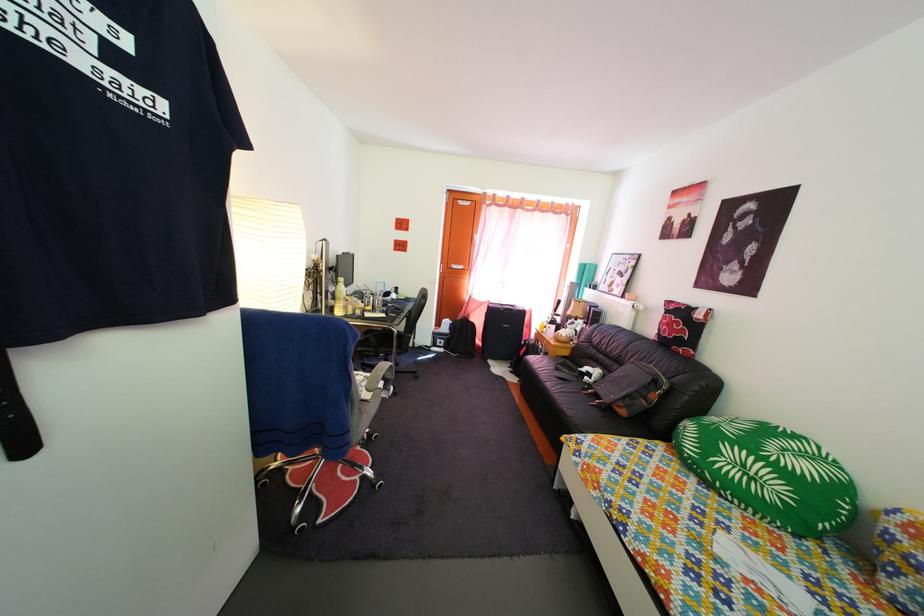
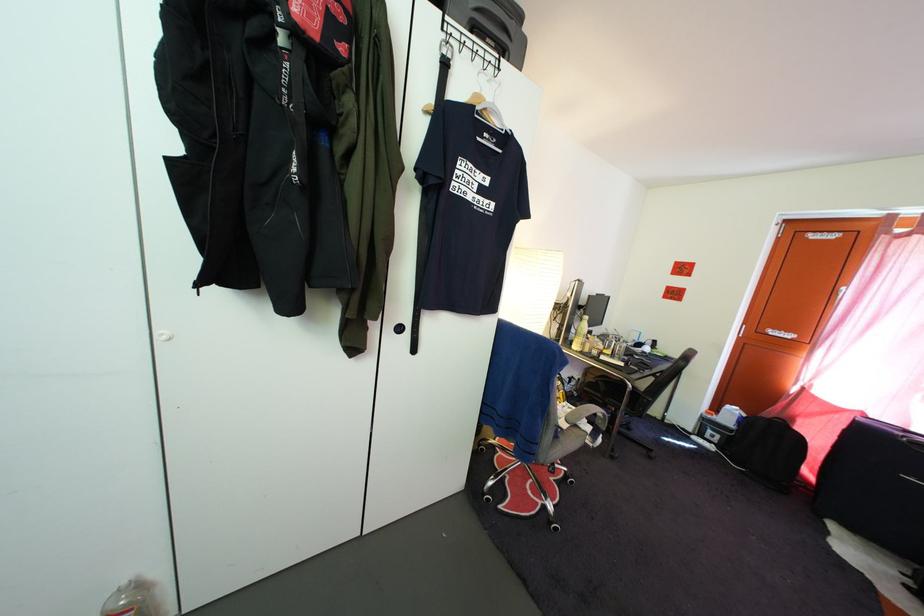
Locate, in the second image, the point that corresponds to [448,351] in the first image.

(721, 445)